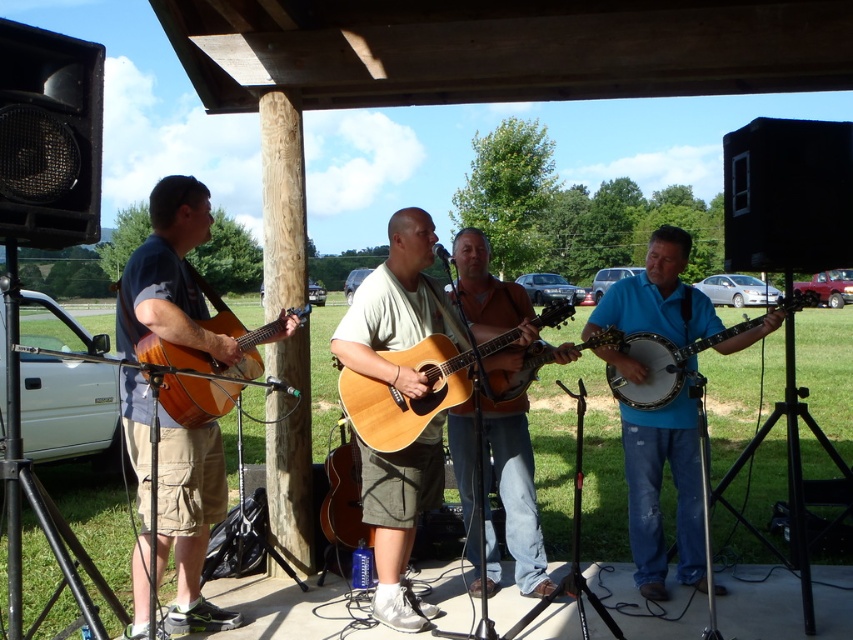
Question: Which of the following is the closest to the observer?

Choices:
 (A) (386, 529)
 (B) (151, 406)
 (C) (520, 323)

Answer: (B)

Question: Can you confirm if blue matte banjo at center is bigger than matte wood guitar at left?

Choices:
 (A) yes
 (B) no

Answer: (A)

Question: Which point is closer to the camera taking this photo?

Choices:
 (A) (154, 196)
 (B) (660, 280)
 (C) (677, 352)
 (D) (419, 497)

Answer: (A)

Question: Which object appears closest to the camera in this image?

Choices:
 (A) light brown wood guitar at center
 (B) light wood acoustic guitar at center
 (C) matte wood guitar at center
 (D) blue matte banjo at center

Answer: (D)

Question: Observing the image, what is the correct spatial positioning of light brown wood guitar at center in reference to matte brown banjo at right?

Choices:
 (A) right
 (B) left

Answer: (B)

Question: Can you confirm if matte brown guitar at left is positioned to the left of light brown wood guitar at center?

Choices:
 (A) yes
 (B) no

Answer: (A)